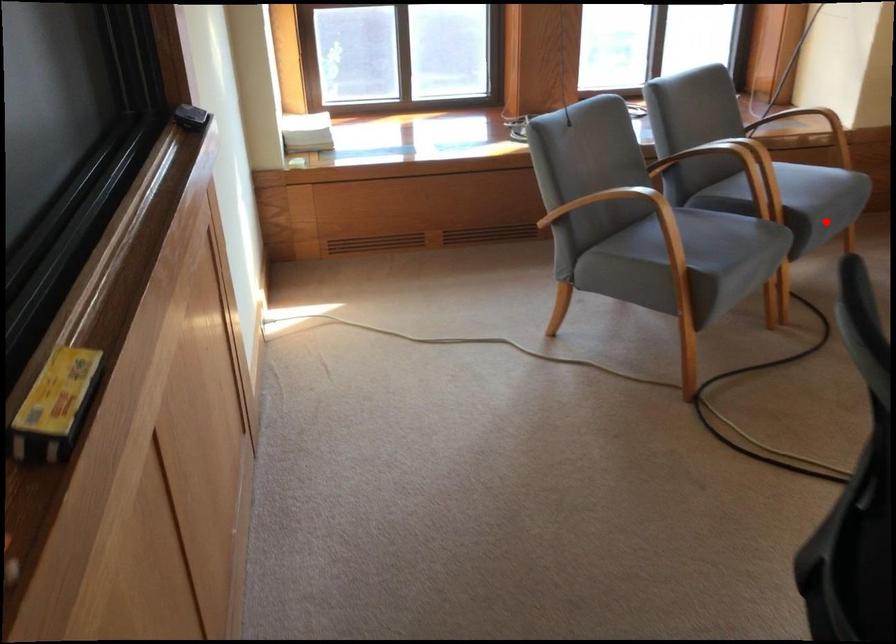
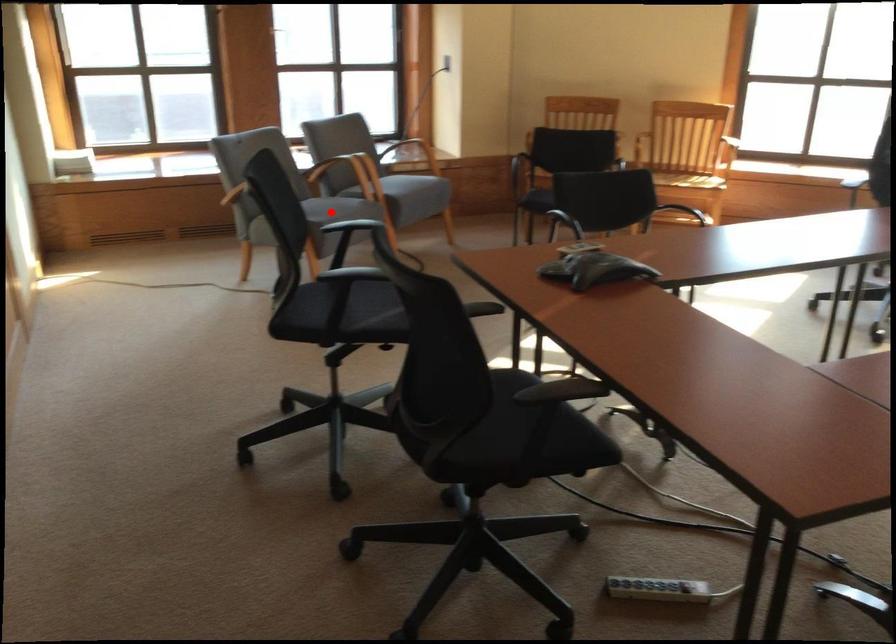
From the picture: I am providing you with two images of the same scene from different viewpoints. A red point is marked on the first image and another point is marked on the second image. Is the red point in image1 aligned with the point shown in image2?

No